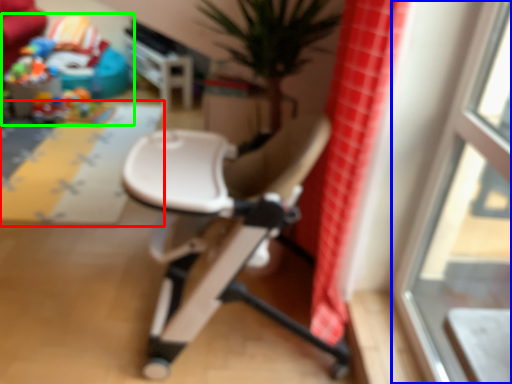
Question: Based on their relative distances, which object is nearer to plain (highlighted by a red box)? Choose from window (highlighted by a blue box) and toy (highlighted by a green box).

Choices:
 (A) window
 (B) toy

Answer: (B)